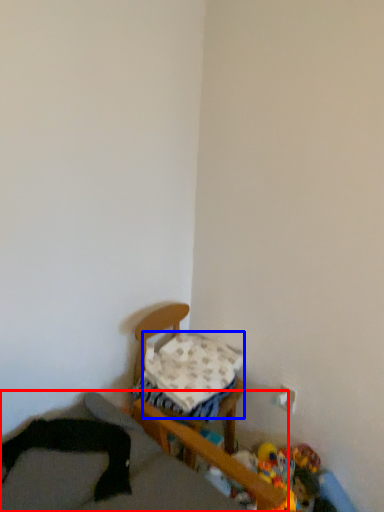
Question: Which of the following is the farthest to the observer, furniture (highlighted by a red box) or pillow (highlighted by a blue box)?

Choices:
 (A) furniture
 (B) pillow

Answer: (B)